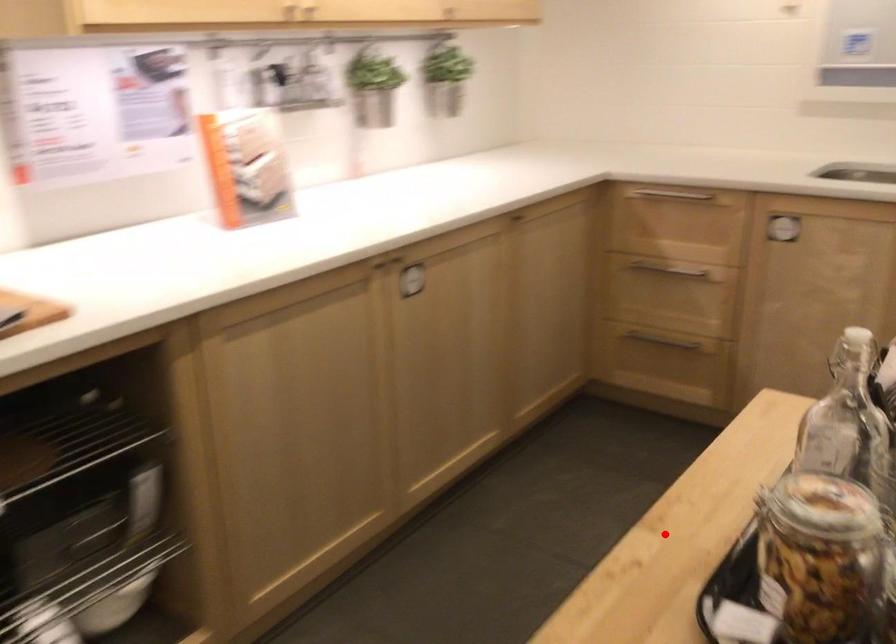
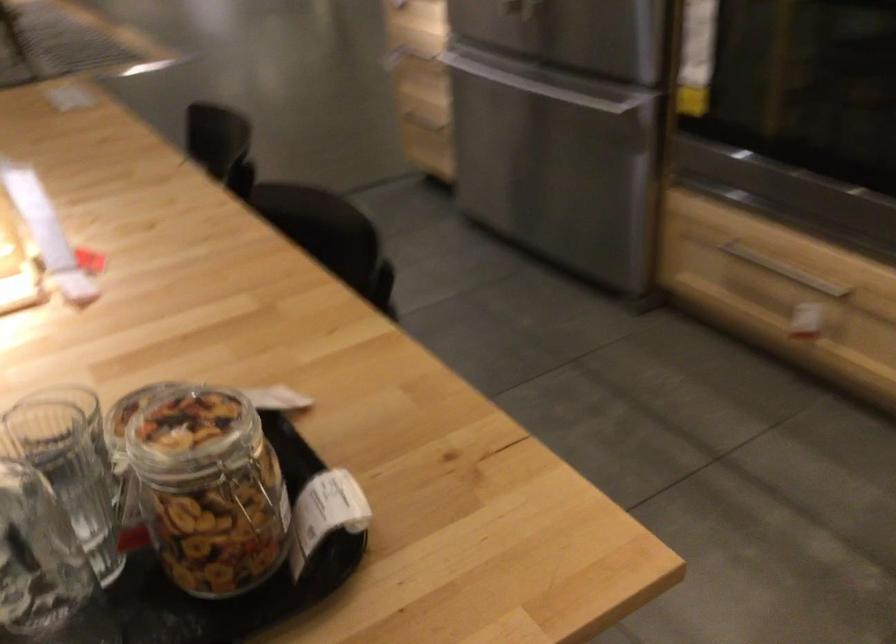
The point at the highlighted location is marked in the first image. Where is the corresponding point in the second image?

(209, 489)